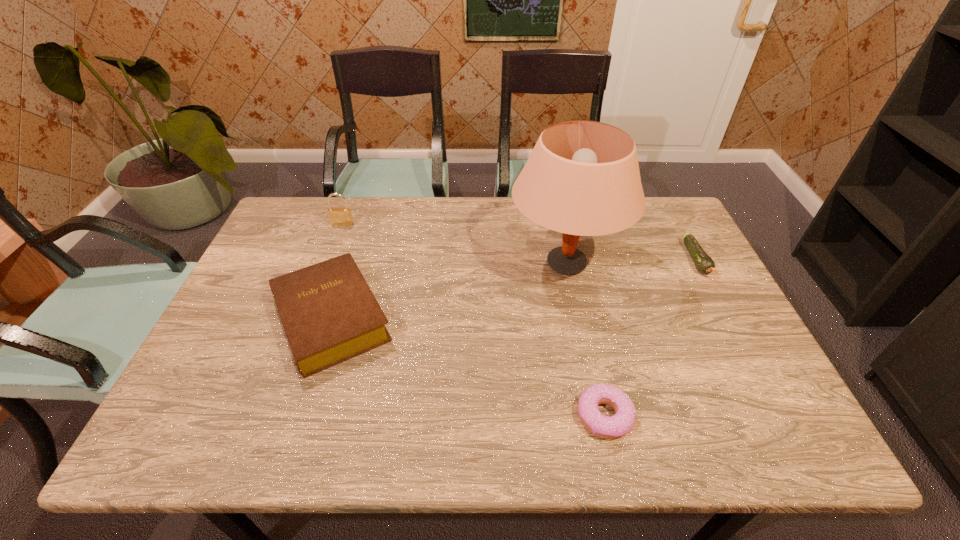
The height and width of the screenshot is (540, 960). Find the location of `vacant space situated 0.090m on the back of the third tallest object`. vacant space situated 0.090m on the back of the third tallest object is located at coordinates (352, 251).

You are a GUI agent. You are given a task and a screenshot of the screen. Output one action in this format:
    pyautogui.click(x=<x>, y=<y>)
    Task: Click on the free point located at the blossom end of the rightmost object
    The image size is (960, 540).
    Given the screenshot: What is the action you would take?
    pyautogui.click(x=757, y=375)

Identify the location of vacant area situated 0.070m on the right of the doughnut. (665, 416).

Identify the location of lampshade located in the far edge section of the desktop. tap(582, 178).

This screenshot has height=540, width=960. What are the coordinates of `padlock present at the far edge` in the screenshot? It's located at (339, 216).

Locate an element on the screen. zucchini at the far edge is located at coordinates (703, 262).

Locate an element on the screen. This screenshot has height=540, width=960. object that is at the near edge is located at coordinates (616, 426).

At what (x,y) coordinates should I click in order to perform the action: click on object that is at the left edge. Please return your answer as a coordinate pair (x, y). Image resolution: width=960 pixels, height=540 pixels. Looking at the image, I should click on pos(330,315).

Image resolution: width=960 pixels, height=540 pixels. Find the location of `object that is at the right edge`. object that is at the right edge is located at coordinates (703, 262).

Where is `object located at the far right corner`? object located at the far right corner is located at coordinates (703, 262).